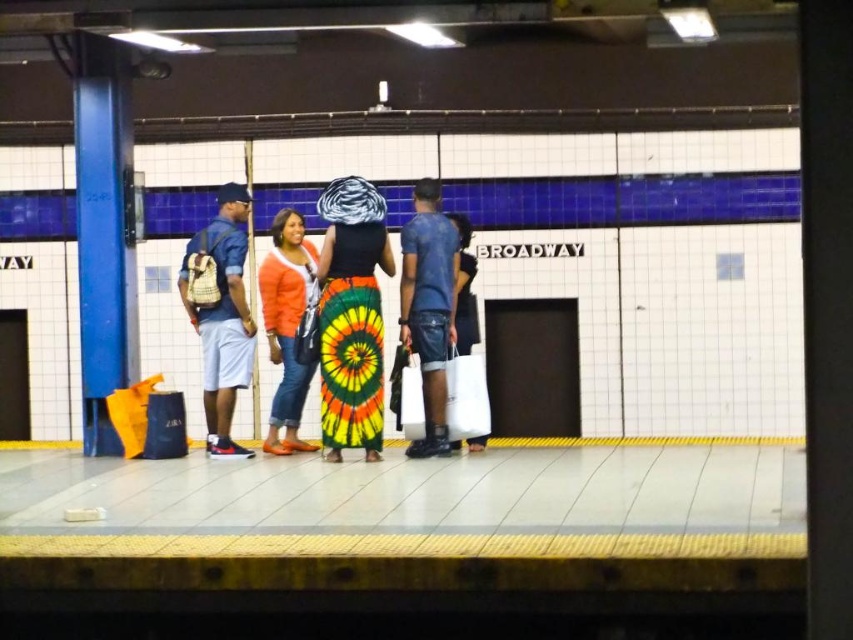
You are a photographer positioned at the subway platform and want to take a photo that includes both the denim shorts at left and the orange cotton sweater at center. Which object should you adjust your camera focus to first to ensure both are in frame?

You should focus on the denim shorts at left first since it is closer to you than the orange cotton sweater at center, ensuring both are within the camera frame.

You are a photographer standing at the subway station platform. You want to take a photo of the denim shorts at left and orange cotton sweater at center. Which item is positioned higher in the frame?

The denim shorts at left is located above the orange cotton sweater at center, so it is positioned higher in the frame.